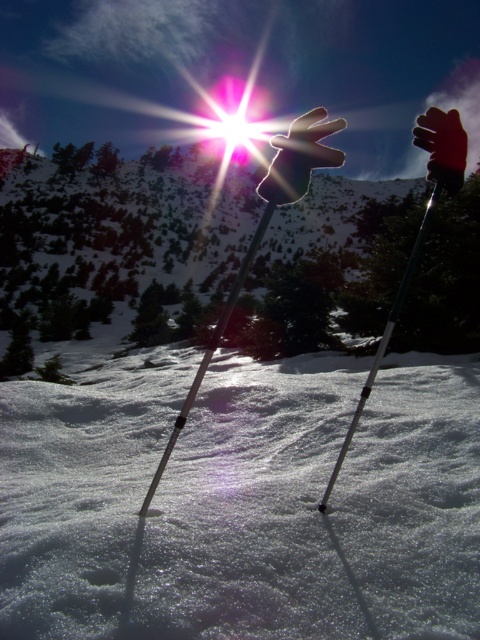
Question: Can you confirm if white snow at center is wider than red matte glove at upper right?

Choices:
 (A) yes
 (B) no

Answer: (A)

Question: Among these objects, which one is farthest from the camera?

Choices:
 (A) white powdery snow at center
 (B) bright metallic sun at center
 (C) matte black ski pole at center
 (D) white snow at center

Answer: (B)

Question: Does white matte glove at center have a smaller size compared to green metallic ski pole at center?

Choices:
 (A) yes
 (B) no

Answer: (B)

Question: Can you confirm if matte black ski pole at center is bigger than red matte glove at upper right?

Choices:
 (A) yes
 (B) no

Answer: (B)

Question: Among these points, which one is farthest from the camera?

Choices:
 (A) (239, 116)
 (B) (302, 218)
 (C) (435, 152)
 (D) (383, 344)

Answer: (A)

Question: Which point is farther to the camera?

Choices:
 (A) red matte glove at upper right
 (B) white matte glove at center
 (C) white snow at center
 (D) bright metallic sun at center

Answer: (D)